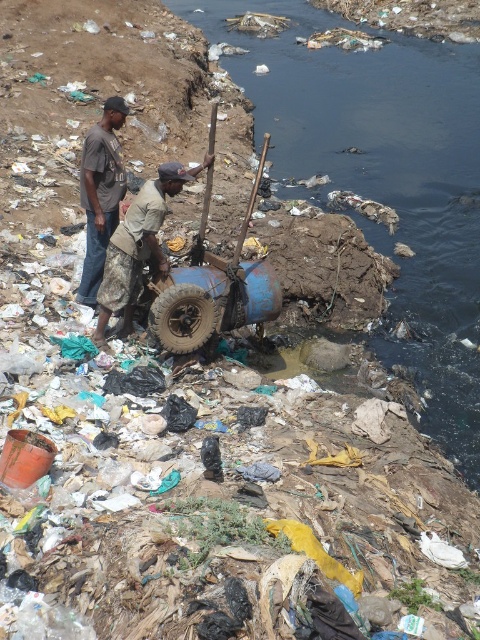
Is black murky water at upper center to the left of dull brown rubber tire at center from the viewer's perspective?

In fact, black murky water at upper center is to the right of dull brown rubber tire at center.

The height and width of the screenshot is (640, 480). I want to click on black murky water at upper center, so click(x=384, y=180).

Looking at this image, who is taller, black murky water at upper center or camouflage-patterned shirt at center?

black murky water at upper center is taller.

You are a GUI agent. You are given a task and a screenshot of the screen. Output one action in this format:
    pyautogui.click(x=<x>, y=<y>)
    Task: Click on the black murky water at upper center
    The image size is (480, 640).
    Given the screenshot: What is the action you would take?
    (x=384, y=180)

Which is below, camouflage-patterned shirt at center or dull brown rubber tire at center?

dull brown rubber tire at center

Who is taller, camouflage-patterned shirt at center or dull brown rubber tire at center?

camouflage-patterned shirt at center is taller.

Between point (140, 218) and point (175, 339), which one is positioned in front?

Point (140, 218) is more forward.

The width and height of the screenshot is (480, 640). Find the location of `camouflage-patterned shirt at center`. camouflage-patterned shirt at center is located at coordinates (137, 246).